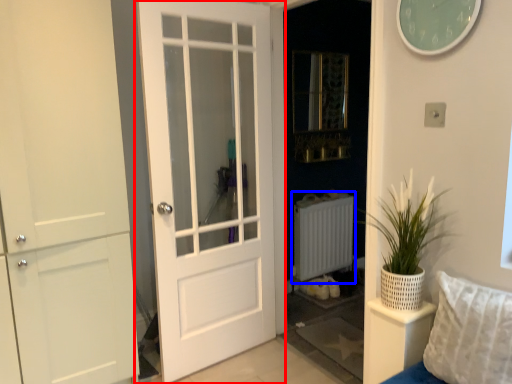
Question: Which point is further to the camera, door (highlighted by a red box) or radiator (highlighted by a blue box)?

Choices:
 (A) door
 (B) radiator

Answer: (B)